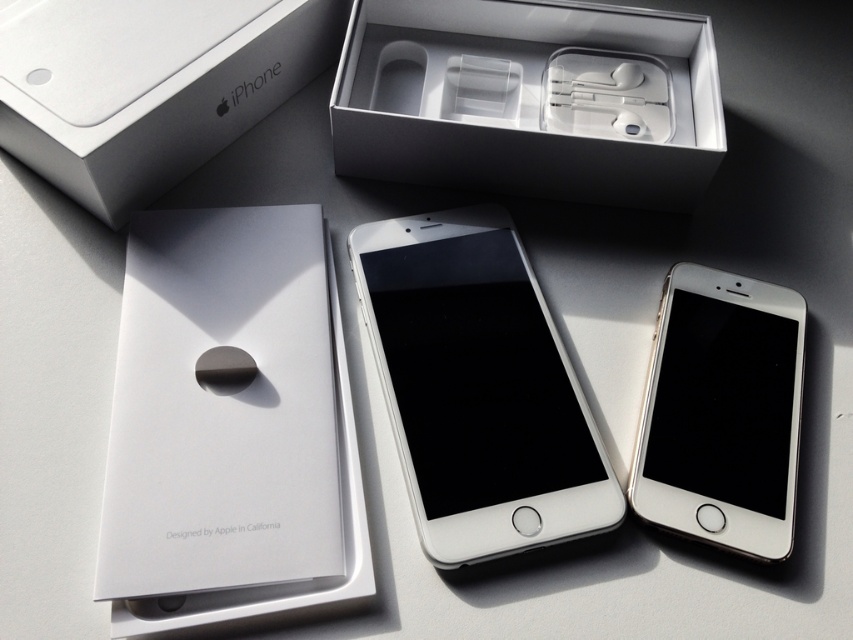
You are looking at the Apple iPhone packaging and accessories arrangement. There is a point at coordinate (531, 99). Which object is located at that point?

The point at coordinate (531, 99) is on white matte earphones at center.

Looking at this image, you are a delivery person who needs to place a small package between the white matte earphones at center and the silver metallic ipod at center. The package is 20 centimeters long. Can you fit it between them without moving either object?

The white matte earphones at center and silver metallic ipod at center are 20.50 centimeters apart. Since the package is 20 centimeters long, it can fit between them as there is enough space.

You are arranging items on a shelf and see the silver metallic ipod at center and the silver metallic ipod at lower right. Which one is positioned higher on the shelf?

The silver metallic ipod at center is positioned higher on the shelf because it is above the silver metallic ipod at lower right.